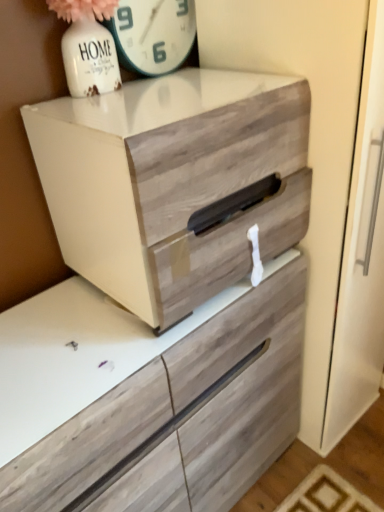
What are the coordinates of `white glossy clock at upper center` in the screenshot? It's located at (153, 34).

What do you see at coordinates (153, 34) in the screenshot? I see `white glossy clock at upper center` at bounding box center [153, 34].

Identify the location of wooden drawer at center. Image resolution: width=384 pixels, height=512 pixels. click(x=159, y=298).

What do you see at coordinates (159, 298) in the screenshot? I see `wooden drawer at center` at bounding box center [159, 298].

Where is `white glossy clock at upper center`? Image resolution: width=384 pixels, height=512 pixels. white glossy clock at upper center is located at coordinates (153, 34).

Between wooden drawer at center and white glossy clock at upper center, which one appears on the right side from the viewer's perspective?

Positioned to the right is wooden drawer at center.

Considering the relative positions of wooden drawer at center and white glossy clock at upper center in the image provided, is wooden drawer at center behind white glossy clock at upper center?

No, it is in front of white glossy clock at upper center.

From the picture: Which is closer to the camera, (294,151) or (146,53)?

Point (294,151).

From the image's perspective, who appears lower, wooden drawer at center or white glossy clock at upper center?

From the image's view, wooden drawer at center is below.

Looking at this image, from a real-world perspective, which object rests below the other?

wooden drawer at center is physically lower.

Considering the relative sizes of wooden drawer at center and white glossy clock at upper center in the image provided, is wooden drawer at center thinner than white glossy clock at upper center?

Incorrect, the width of wooden drawer at center is not less than that of white glossy clock at upper center.

Considering the sizes of wooden drawer at center and white glossy clock at upper center in the image, is wooden drawer at center taller or shorter than white glossy clock at upper center?

wooden drawer at center is taller than white glossy clock at upper center.

From the picture: Considering the sizes of wooden drawer at center and white glossy clock at upper center in the image, is wooden drawer at center bigger or smaller than white glossy clock at upper center?

In the image, wooden drawer at center appears to be larger than white glossy clock at upper center.

Is wooden drawer at center inside or outside of white glossy clock at upper center?

wooden drawer at center cannot be found inside white glossy clock at upper center.

Are wooden drawer at center and white glossy clock at upper center far apart?

That's not correct — wooden drawer at center is a little close to white glossy clock at upper center.

Could you tell me if wooden drawer at center is turned towards white glossy clock at upper center?

No, wooden drawer at center is not facing towards white glossy clock at upper center.

Measure the distance between wooden drawer at center and white glossy clock at upper center.

wooden drawer at center and white glossy clock at upper center are 22.10 inches apart.

Where is `clock above the wooden drawer at center (from a real-world perspective)`? The image size is (384, 512). clock above the wooden drawer at center (from a real-world perspective) is located at coordinates (153, 34).

Which is more to the left, white glossy clock at upper center or wooden drawer at center?

white glossy clock at upper center is more to the left.

Is white glossy clock at upper center in front of wooden drawer at center?

No.

Considering the points (170, 46) and (186, 129), which point is behind, point (170, 46) or point (186, 129)?

The point (170, 46) is behind.

From the image's perspective, is white glossy clock at upper center located above or below wooden drawer at center?

white glossy clock at upper center is above wooden drawer at center.

From a real-world perspective, relative to wooden drawer at center, is white glossy clock at upper center vertically above or below?

In terms of real-world spatial position, white glossy clock at upper center is above wooden drawer at center.

Between white glossy clock at upper center and wooden drawer at center, which one has smaller width?

Thinner between the two is white glossy clock at upper center.

Does white glossy clock at upper center have a greater height compared to wooden drawer at center?

In fact, white glossy clock at upper center may be shorter than wooden drawer at center.

Is white glossy clock at upper center bigger than wooden drawer at center?

Incorrect, white glossy clock at upper center is not larger than wooden drawer at center.

Is white glossy clock at upper center completely or partially outside of wooden drawer at center?

Yes, white glossy clock at upper center is outside of wooden drawer at center.

Are white glossy clock at upper center and wooden drawer at center far apart?

That's not correct — white glossy clock at upper center is a little close to wooden drawer at center.

Could you tell me if white glossy clock at upper center is facing wooden drawer at center?

No, white glossy clock at upper center is not oriented towards wooden drawer at center.

Can you tell me how much white glossy clock at upper center and wooden drawer at center differ in facing direction?

1.85 degrees separate the facing orientations of white glossy clock at upper center and wooden drawer at center.

Identify the location of clock above the wooden drawer at center (from the image's perspective). (153, 34).

This screenshot has width=384, height=512. In order to click on chest of drawers below the white glossy clock at upper center (from a real-world perspective) in this screenshot , I will do `click(159, 298)`.

You are a GUI agent. You are given a task and a screenshot of the screen. Output one action in this format:
    pyautogui.click(x=<x>, y=<y>)
    Task: Click on the clock behind the wooden drawer at center
    
    Given the screenshot: What is the action you would take?
    pyautogui.click(x=153, y=34)